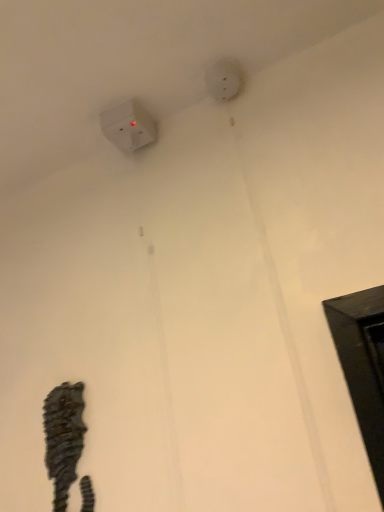
Question: Is rustic wood seahorse at lower left facing towards white matte electric outlet at upper center?

Choices:
 (A) no
 (B) yes

Answer: (A)

Question: Is rustic wood seahorse at lower left taller than white matte electric outlet at upper center?

Choices:
 (A) no
 (B) yes

Answer: (B)

Question: Are rustic wood seahorse at lower left and white matte electric outlet at upper center located far from each other?

Choices:
 (A) no
 (B) yes

Answer: (A)

Question: Does rustic wood seahorse at lower left have a lesser height compared to white matte electric outlet at upper center?

Choices:
 (A) yes
 (B) no

Answer: (B)

Question: From a real-world perspective, is rustic wood seahorse at lower left under white matte electric outlet at upper center?

Choices:
 (A) yes
 (B) no

Answer: (A)

Question: Can you confirm if rustic wood seahorse at lower left is positioned to the right of white matte electric outlet at upper center?

Choices:
 (A) no
 (B) yes

Answer: (A)

Question: Is white matte electric outlet at upper center facing towards rustic wood seahorse at lower left?

Choices:
 (A) no
 (B) yes

Answer: (A)

Question: Is white matte electric outlet at upper center further to the viewer compared to rustic wood seahorse at lower left?

Choices:
 (A) yes
 (B) no

Answer: (A)

Question: Is white matte electric outlet at upper center not within rustic wood seahorse at lower left?

Choices:
 (A) no
 (B) yes

Answer: (B)

Question: Does white matte electric outlet at upper center have a larger size compared to rustic wood seahorse at lower left?

Choices:
 (A) yes
 (B) no

Answer: (B)

Question: Is white matte electric outlet at upper center at the left side of rustic wood seahorse at lower left?

Choices:
 (A) yes
 (B) no

Answer: (B)

Question: From a real-world perspective, is white matte electric outlet at upper center on top of rustic wood seahorse at lower left?

Choices:
 (A) yes
 (B) no

Answer: (A)

Question: Considering the relative sizes of white matte electric outlet at upper center and white plastic power plug at upper left in the image provided, is white matte electric outlet at upper center smaller than white plastic power plug at upper left?

Choices:
 (A) no
 (B) yes

Answer: (B)